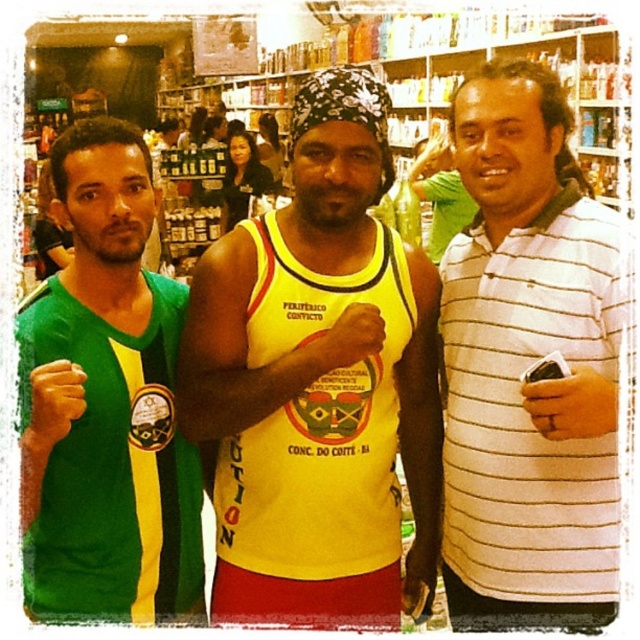
Which is above, white striped polo shirt at right or green jersey at left?

white striped polo shirt at right

Is white striped polo shirt at right shorter than green jersey at left?

In fact, white striped polo shirt at right may be taller than green jersey at left.

Between point (472, 163) and point (125, 168), which one is positioned in front?

Point (125, 168) is more forward.

Identify the location of white striped polo shirt at right. The width and height of the screenshot is (640, 640). pos(529,364).

Between yellow fabric tank top at center and white striped polo shirt at right, which one has more height?

With more height is white striped polo shirt at right.

Does yellow fabric tank top at center have a smaller size compared to white striped polo shirt at right?

Actually, yellow fabric tank top at center might be larger than white striped polo shirt at right.

Does point (296, 163) lie in front of point (556, 573)?

No, (296, 163) is further to viewer.

Find the location of a particular element. This screenshot has width=640, height=640. yellow fabric tank top at center is located at coordinates (317, 378).

Can you confirm if yellow fabric tank top at center is bigger than green jersey at left?

Yes.

Is yellow fabric tank top at center smaller than green jersey at left?

Incorrect, yellow fabric tank top at center is not smaller in size than green jersey at left.

Between point (296, 497) and point (140, 394), which one is positioned behind?

Point (296, 497)

Locate an element on the screen. Image resolution: width=640 pixels, height=640 pixels. yellow fabric tank top at center is located at coordinates (317, 378).